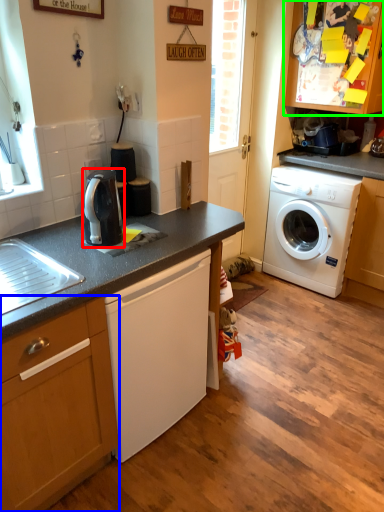
Question: Based on their relative distances, which object is nearer to kitchen appliance (highlighted by a red box)? Choose from cabinetry (highlighted by a blue box) and cabinetry (highlighted by a green box).

Choices:
 (A) cabinetry
 (B) cabinetry

Answer: (A)